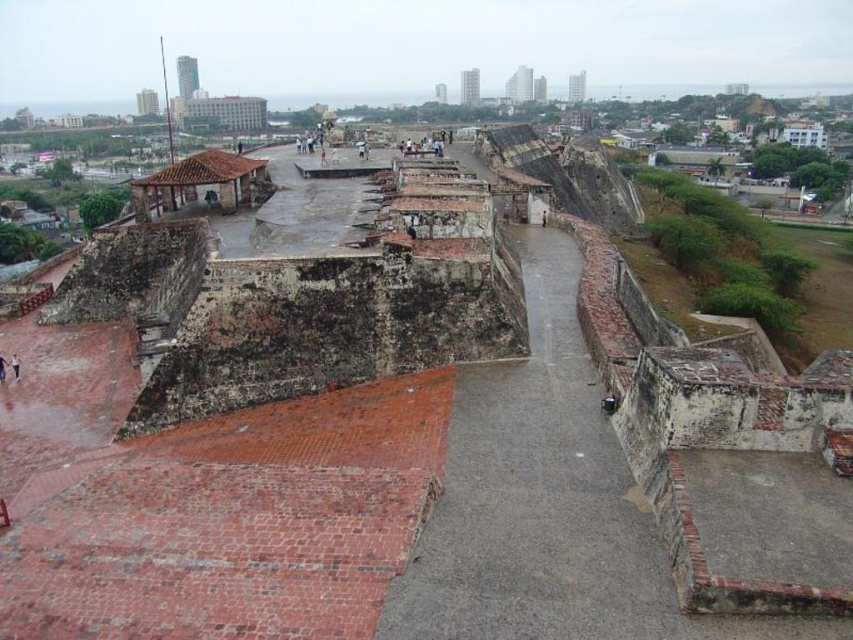
Is smooth concrete path at center taller than dark gray stone person at center?

Correct, smooth concrete path at center is much taller as dark gray stone person at center.

Locate an element on the screen. The width and height of the screenshot is (853, 640). smooth concrete path at center is located at coordinates (535, 496).

Identify the location of smooth concrete path at center. (535, 496).

Which of these two, smooth concrete path at center or dark blue jeans at lower left, stands taller?

With more height is smooth concrete path at center.

This screenshot has height=640, width=853. What do you see at coordinates (535, 496) in the screenshot? I see `smooth concrete path at center` at bounding box center [535, 496].

Identify the location of smooth concrete path at center. The height and width of the screenshot is (640, 853). (535, 496).

Which is more to the left, smooth concrete path at center or brown leather shoe at lower left?

brown leather shoe at lower left is more to the left.

Which is in front, point (514, 570) or point (10, 358)?

Positioned in front is point (514, 570).

Between point (573, 612) and point (16, 371), which one is positioned in front?

Point (573, 612) is more forward.

Where is `smooth concrete path at center`? smooth concrete path at center is located at coordinates (535, 496).